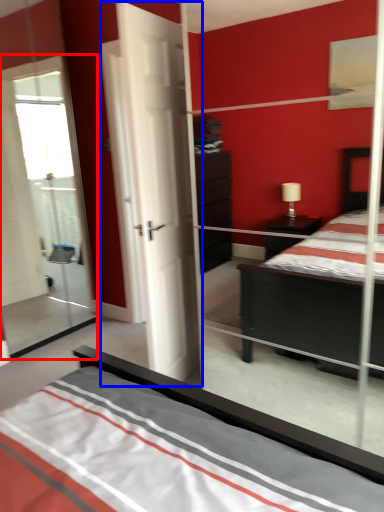
Question: Which object appears farthest to the camera in this image, glass door (highlighted by a red box) or door (highlighted by a blue box)?

Choices:
 (A) glass door
 (B) door

Answer: (A)